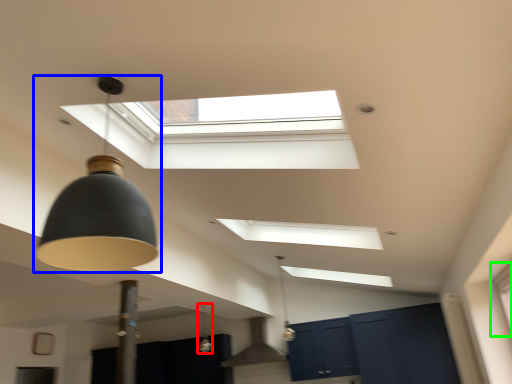
Question: Estimate the real-world distances between objects in this image. Which object is closer to lamp (highlighted by a red box), lamp (highlighted by a blue box) or window (highlighted by a green box)?

Choices:
 (A) lamp
 (B) window

Answer: (B)